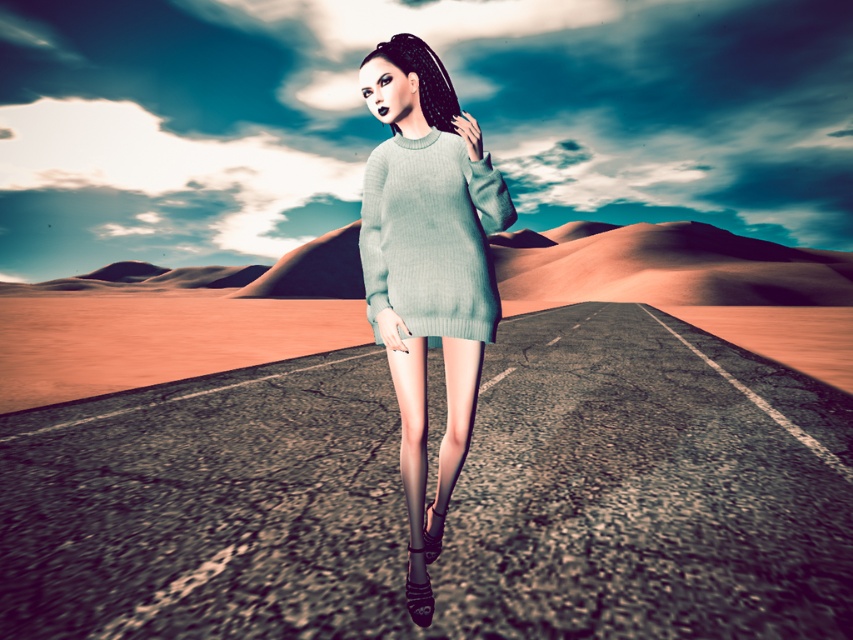
Which is more to the left, light blue knitted sweater at center or light blue knitted dress at center?

light blue knitted dress at center is more to the left.

Is point (477, 154) positioned behind point (434, 134)?

No.

Locate an element on the screen. The width and height of the screenshot is (853, 640). light blue knitted sweater at center is located at coordinates (427, 269).